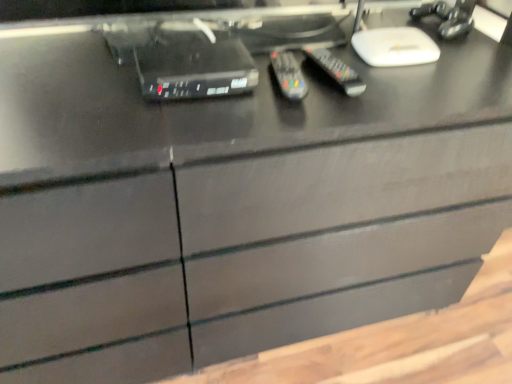
Locate an element on the screen. vacant area that is situated to the right of black plastic remote at center, acting as the first control starting from the right is located at coordinates (424, 84).